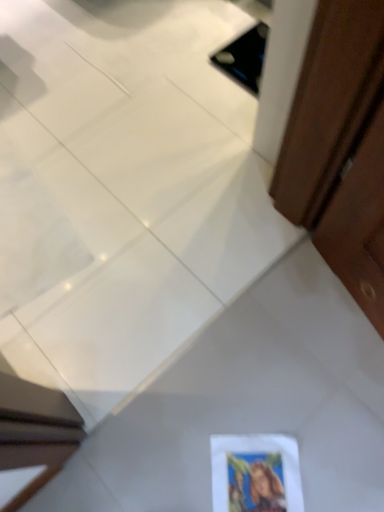
Where is `free space to the back side of white paper postcard at lower center`? free space to the back side of white paper postcard at lower center is located at coordinates (248, 396).